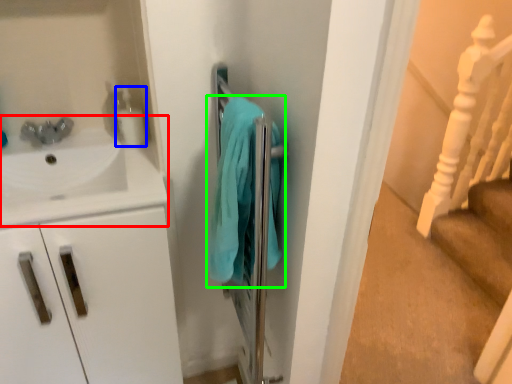
Question: Which object is the farthest from sink (highlighted by a red box)? Choose among these: soap dispenser (highlighted by a blue box) or bath towel (highlighted by a green box).

Choices:
 (A) soap dispenser
 (B) bath towel

Answer: (B)